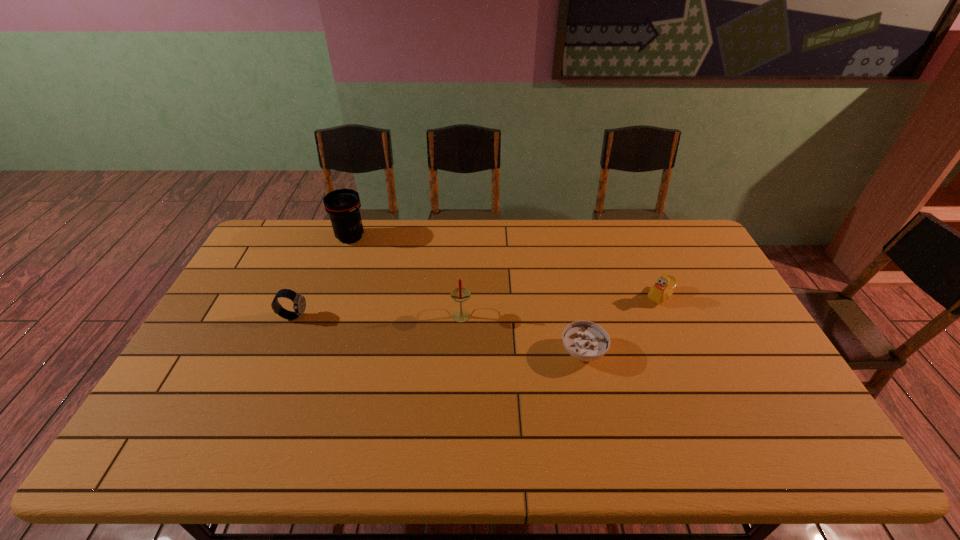
Locate an element on the screen. This screenshot has width=960, height=540. the farthest object is located at coordinates (342, 205).

Locate an element on the screen. the third object from left to right is located at coordinates (460, 294).

This screenshot has width=960, height=540. Find the location of `watch`. watch is located at coordinates (299, 301).

Locate an element on the screen. the rightmost object is located at coordinates (665, 285).

I want to click on the shortest object, so click(586, 341).

Image resolution: width=960 pixels, height=540 pixels. I want to click on the nearest object, so click(x=586, y=341).

The height and width of the screenshot is (540, 960). I want to click on vacant region located 0.050m on the right of the telephoto lens, so click(x=381, y=237).

You are a GUI agent. You are given a task and a screenshot of the screen. Output one action in this format:
    pyautogui.click(x=<x>, y=<y>)
    Task: Click on the vacant space located 0.120m on the back of the third object from right to left
    
    Given the screenshot: What is the action you would take?
    pyautogui.click(x=463, y=280)

Where is `free point located on the face of the watch`? free point located on the face of the watch is located at coordinates (360, 316).

Find the location of a particular element. This screenshot has height=540, width=960. vacant space located at the beak of the duck is located at coordinates (535, 296).